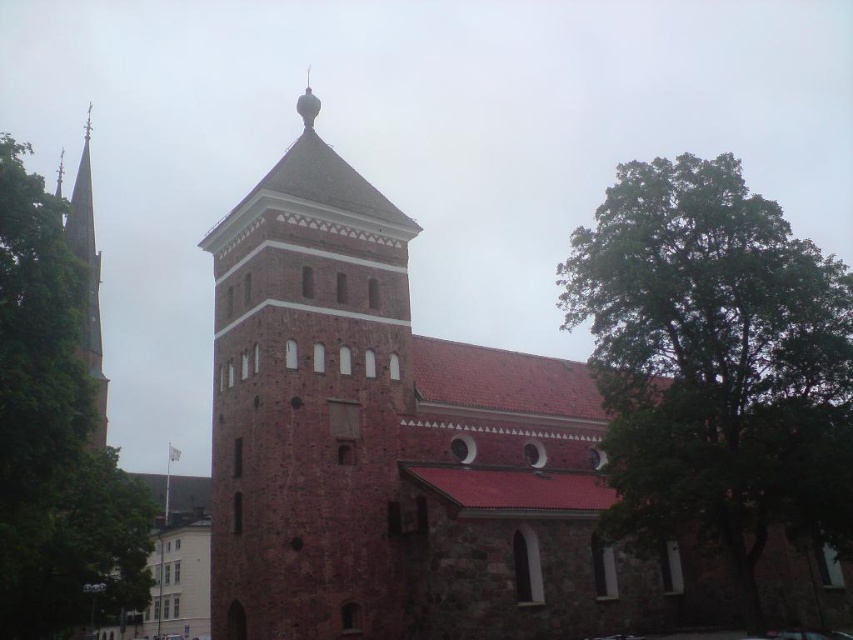
From the picture: You are standing at a point 155.79 feet away from the camera. The historic stone church with its red roof and tower is in front of you. There is a point marked at coordinates point [231,608]. Can you tell me if this point is located on the main church tower or the adjacent taller spire to the left?

The point [231,608] is located on the main church tower because it is closer to the camera compared to the adjacent taller spire to the left, which is farther away.

You are standing in front of the brown stone church at center and looking towards the green leafy tree at left. Which object is positioned lower in the image?

The brown stone church at center is located below the green leafy tree at left, so the brown stone church at center is positioned lower in the image.